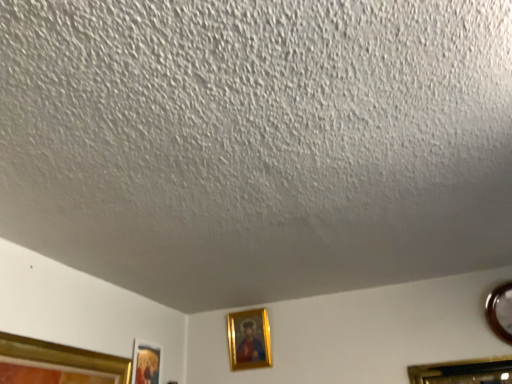
Question: Is point (136, 370) positioned closer to the camera than point (233, 367)?

Choices:
 (A) closer
 (B) farther

Answer: (A)

Question: In the image, is gold-framed picture at lower left, positioned as the third picture frame in right-to-left order, positioned in front of or behind gold-framed picture at center, the second picture frame positioned from the left?

Choices:
 (A) front
 (B) behind

Answer: (A)

Question: Considering the real-world distances, which object is closest to the gold-framed picture at lower left, the 1th picture frame positioned from the left?

Choices:
 (A) metallic circular frame at right, the third picture frame in the left-to-right sequence
 (B) gold-framed picture at center, the second picture frame positioned from the left

Answer: (B)

Question: Which is nearer to the metallic circular frame at right, the third picture frame in the left-to-right sequence?

Choices:
 (A) gold-framed picture at lower left, the 1th picture frame positioned from the left
 (B) gold-framed picture at center, acting as the 2th picture frame starting from the right

Answer: (B)